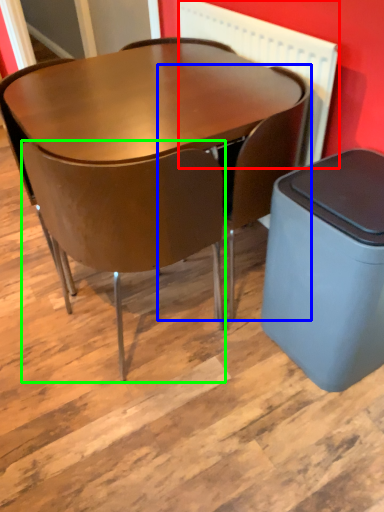
Question: Which object is the closest to the radiator (highlighted by a red box)? Choose among these: chair (highlighted by a blue box) or chair (highlighted by a green box).

Choices:
 (A) chair
 (B) chair

Answer: (A)